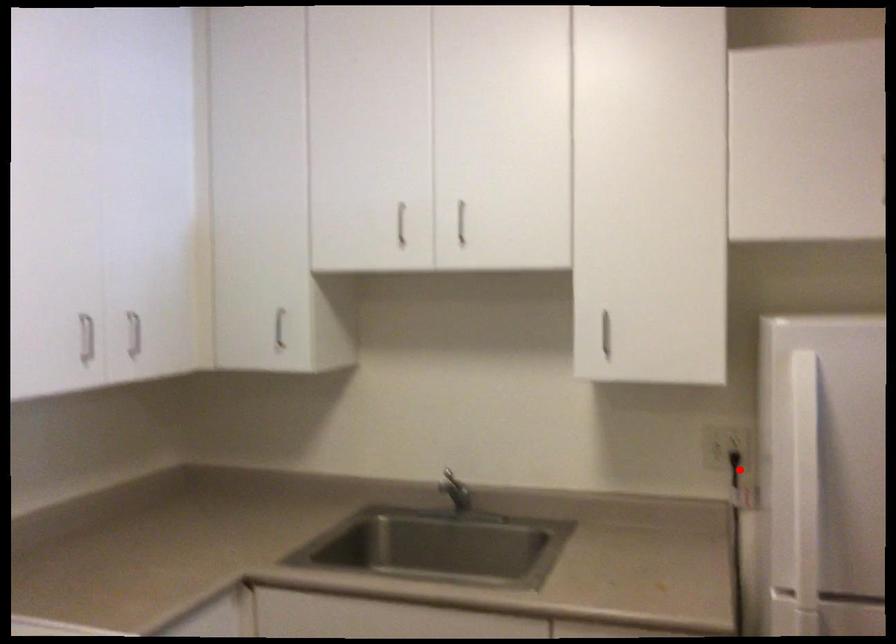
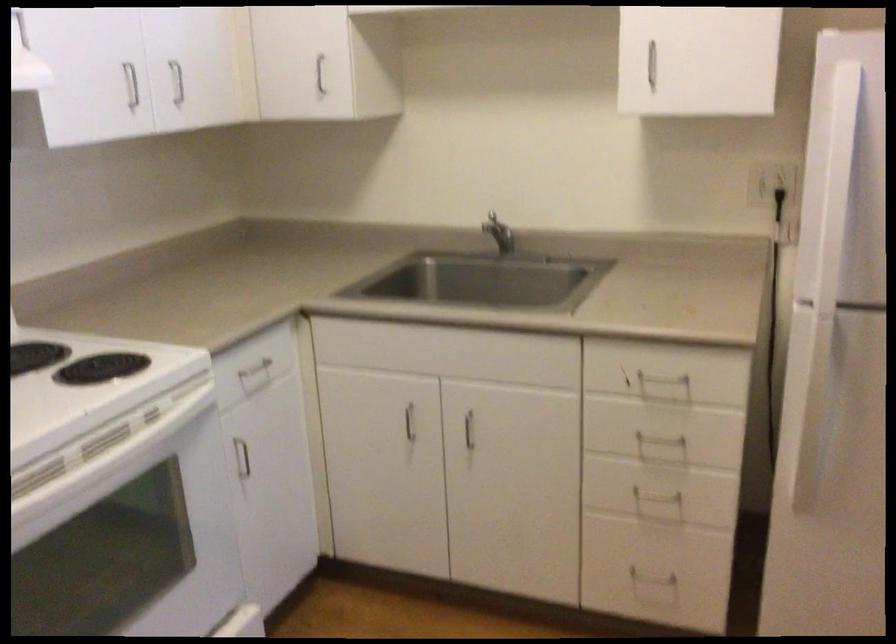
Question: I am providing you with two images of the same scene from different viewpoints. A red point is marked on the first image. Is the red point's position out of view in image 2?

Choices:
 (A) Yes
 (B) No

Answer: (B)